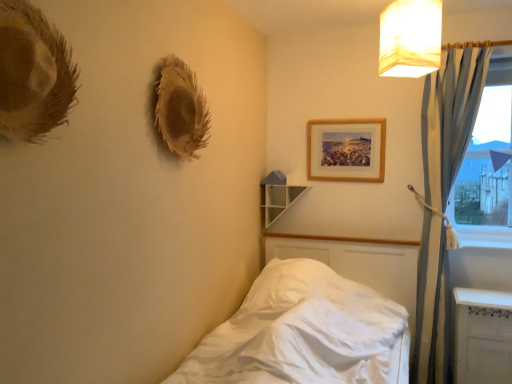
Question: From a real-world perspective, is blue fabric curtain at right positioned over white glossy radiator at lower right based on gravity?

Choices:
 (A) yes
 (B) no

Answer: (A)

Question: Does blue fabric curtain at right have a smaller size compared to white glossy radiator at lower right?

Choices:
 (A) yes
 (B) no

Answer: (B)

Question: Is blue fabric curtain at right positioned before white glossy radiator at lower right?

Choices:
 (A) yes
 (B) no

Answer: (B)

Question: Is the surface of blue fabric curtain at right in direct contact with white glossy radiator at lower right?

Choices:
 (A) no
 (B) yes

Answer: (A)

Question: Can you confirm if blue fabric curtain at right is bigger than white glossy radiator at lower right?

Choices:
 (A) no
 (B) yes

Answer: (B)

Question: Considering the positions of white glossy window sill at lower right and white fabric lampshade at upper right in the image, is white glossy window sill at lower right taller or shorter than white fabric lampshade at upper right?

Choices:
 (A) short
 (B) tall

Answer: (A)

Question: Considering the positions of white glossy window sill at lower right and white fabric lampshade at upper right in the image, is white glossy window sill at lower right bigger or smaller than white fabric lampshade at upper right?

Choices:
 (A) small
 (B) big

Answer: (A)

Question: Is point (473, 240) closer or farther from the camera than point (438, 56)?

Choices:
 (A) closer
 (B) farther

Answer: (B)

Question: From the image's perspective, is white glossy window sill at lower right located above or below white fabric lampshade at upper right?

Choices:
 (A) above
 (B) below

Answer: (B)

Question: Does point (275, 173) appear closer or farther from the camera than point (501, 291)?

Choices:
 (A) farther
 (B) closer

Answer: (A)

Question: From the image's perspective, is white glossy shelf at upper center located above or below white glossy radiator at lower right?

Choices:
 (A) above
 (B) below

Answer: (A)

Question: Would you say white glossy shelf at upper center is to the left or to the right of white glossy radiator at lower right in the picture?

Choices:
 (A) right
 (B) left

Answer: (B)

Question: In terms of size, does white glossy shelf at upper center appear bigger or smaller than white glossy radiator at lower right?

Choices:
 (A) big
 (B) small

Answer: (B)

Question: From a real-world perspective, is white satin bed at lower left above or below wooden picture frame at upper center?

Choices:
 (A) below
 (B) above

Answer: (A)

Question: Is white satin bed at lower left wider or thinner than wooden picture frame at upper center?

Choices:
 (A) wide
 (B) thin

Answer: (A)